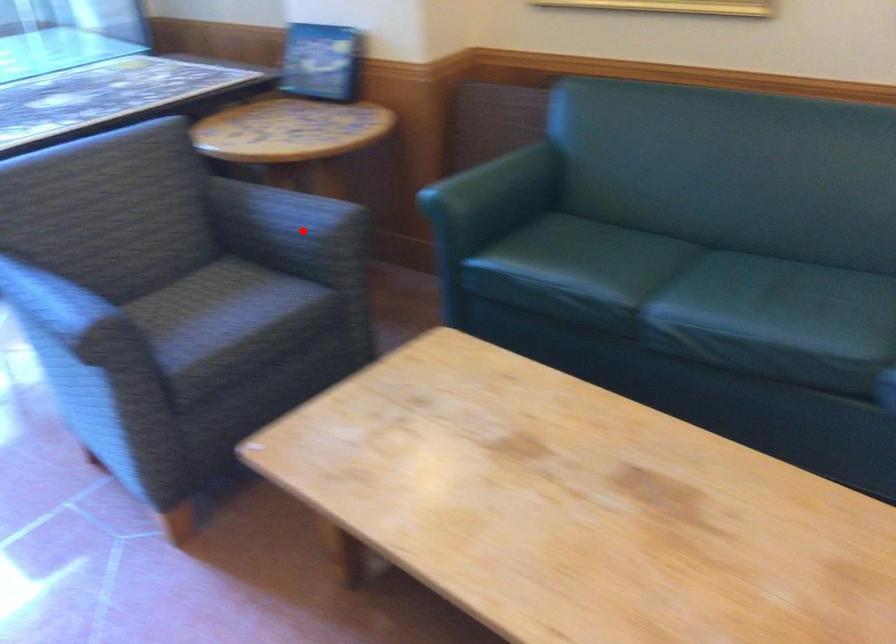
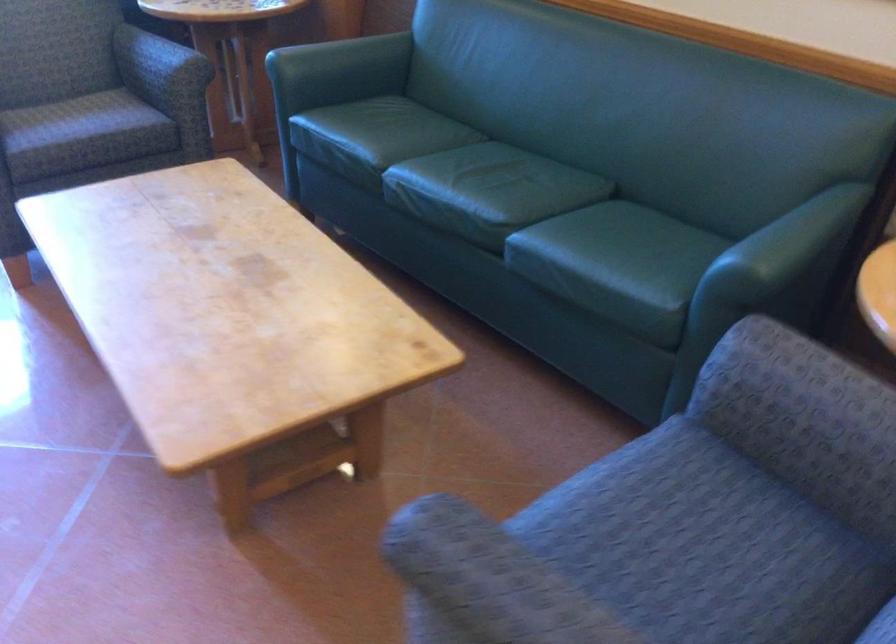
Where in the second image is the point corresponding to the highlighted location from the first image?

(158, 62)